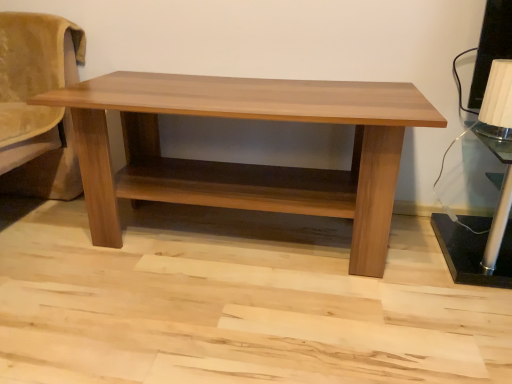
Question: Should I look upward or downward to see light brown wood table at center?

Choices:
 (A) down
 (B) up

Answer: (B)

Question: Is black metallic table lamp at right, which appears as the 2th table lamp when viewed from the top, closer to the viewer compared to light brown wood table at center?

Choices:
 (A) yes
 (B) no

Answer: (B)

Question: Is light brown wood table at center completely or partially inside black metallic table lamp at right, which appears as the 2th table lamp when viewed from the top?

Choices:
 (A) yes
 (B) no

Answer: (B)

Question: Is black metallic table lamp at right, which appears as the 2th table lamp when viewed from the top, behind light brown wood table at center?

Choices:
 (A) yes
 (B) no

Answer: (A)

Question: Considering the relative sizes of black metallic table lamp at right, which appears as the 2th table lamp when viewed from the top, and light brown wood table at center in the image provided, is black metallic table lamp at right, which appears as the 2th table lamp when viewed from the top, smaller than light brown wood table at center?

Choices:
 (A) yes
 (B) no

Answer: (A)

Question: Is black metallic table lamp at right, the 1th table lamp in the bottom-to-top sequence, not within light brown wood table at center?

Choices:
 (A) yes
 (B) no

Answer: (A)

Question: Considering the relative sizes of black metallic table lamp at right, the 1th table lamp in the bottom-to-top sequence, and light brown wood table at center in the image provided, is black metallic table lamp at right, the 1th table lamp in the bottom-to-top sequence, wider than light brown wood table at center?

Choices:
 (A) yes
 (B) no

Answer: (B)

Question: Considering the relative sizes of light brown wood table at center and black metallic table lamp at right, the 1th table lamp in the bottom-to-top sequence, in the image provided, is light brown wood table at center smaller than black metallic table lamp at right, the 1th table lamp in the bottom-to-top sequence,?

Choices:
 (A) no
 (B) yes

Answer: (A)

Question: Are light brown wood table at center and black metallic table lamp at right, the 1th table lamp in the bottom-to-top sequence, making contact?

Choices:
 (A) yes
 (B) no

Answer: (B)

Question: From a real-world perspective, is light brown wood table at center positioned over black metallic table lamp at right, the 1th table lamp in the bottom-to-top sequence, based on gravity?

Choices:
 (A) yes
 (B) no

Answer: (A)

Question: From a real-world perspective, is light brown wood table at center beneath black metallic table lamp at right, the 1th table lamp in the bottom-to-top sequence?

Choices:
 (A) yes
 (B) no

Answer: (B)

Question: Is light brown wood table at center not inside black metallic table lamp at right, which appears as the 2th table lamp when viewed from the top?

Choices:
 (A) yes
 (B) no

Answer: (A)

Question: Does light brown wood table at center have a larger size compared to black metallic table lamp at right, which appears as the 2th table lamp when viewed from the top?

Choices:
 (A) yes
 (B) no

Answer: (A)

Question: From the image's perspective, is white textured lampshade at upper right, which ranks as the 2th table lamp in bottom-to-top order, under light brown wood table at center?

Choices:
 (A) yes
 (B) no

Answer: (B)